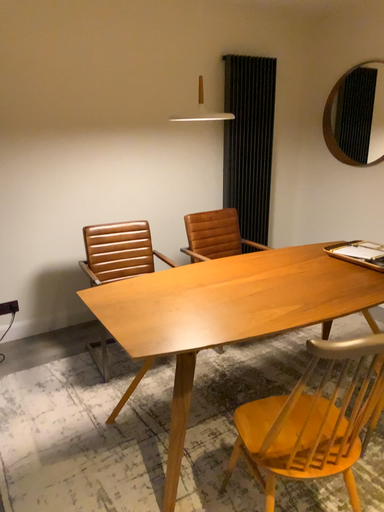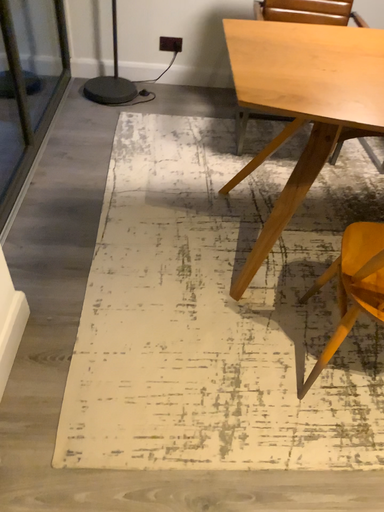
Question: How did the camera likely rotate when shooting the video?

Choices:
 (A) rotated upward
 (B) rotated downward

Answer: (B)